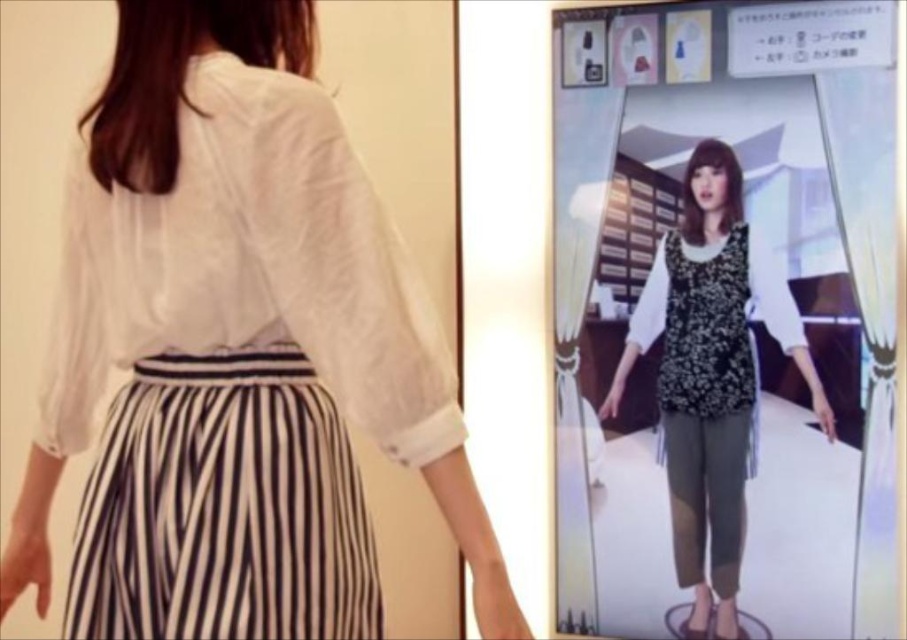
Question: Which point is closer to the camera?

Choices:
 (A) white sheer blouse at upper left
 (B) floral-patterned fabric top at center

Answer: (A)

Question: Is white sheer blouse at upper left thinner than floral-patterned fabric top at center?

Choices:
 (A) no
 (B) yes

Answer: (A)

Question: Can you confirm if white sheer blouse at upper left is positioned below floral-patterned fabric top at center?

Choices:
 (A) yes
 (B) no

Answer: (B)

Question: Is white sheer blouse at upper left above floral-patterned fabric top at center?

Choices:
 (A) yes
 (B) no

Answer: (A)